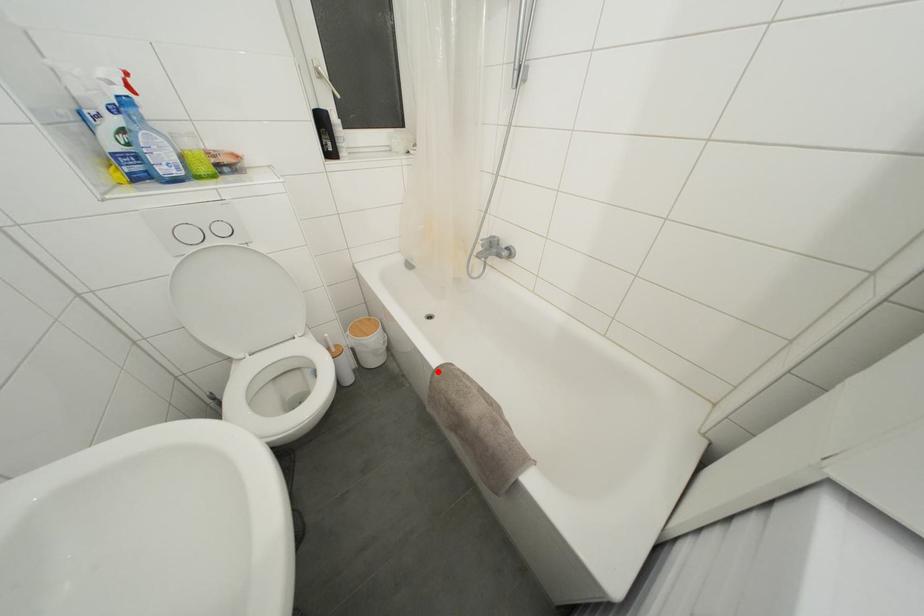
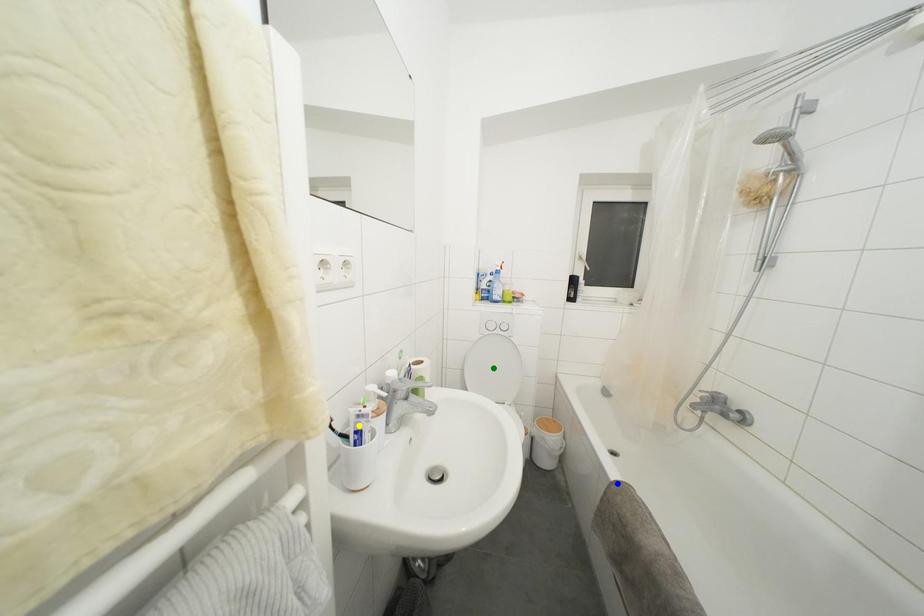
Question: I am providing you with two images of the same scene from different viewpoints. A red point is marked on the first image. You are given multiple points on the second image. Can you choose the point in image 2 that corresponds to the point in image 1?

Choices:
 (A) blue point
 (B) green point
 (C) yellow point

Answer: (A)